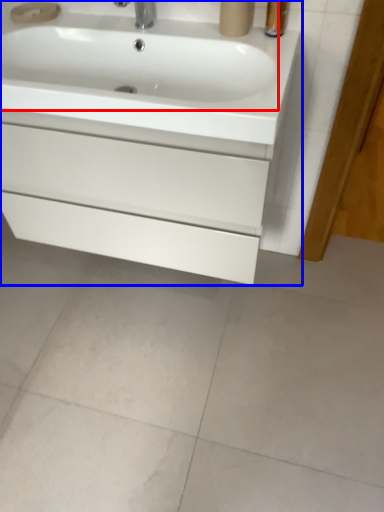
Question: Among these objects, which one is nearest to the camera, sink (highlighted by a red box) or bathroom cabinet (highlighted by a blue box)?

Choices:
 (A) sink
 (B) bathroom cabinet

Answer: (A)